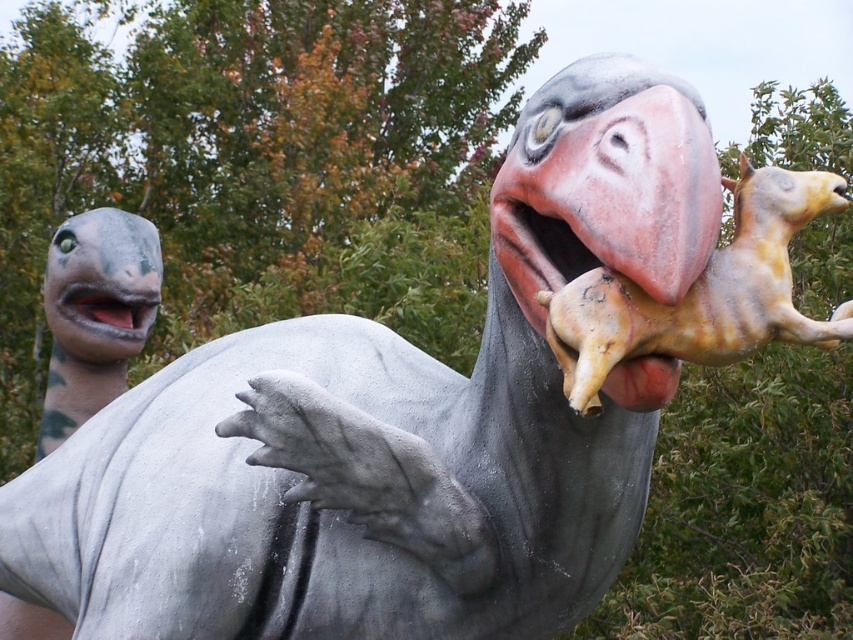
Who is higher up, speckled yellowish-brown horse at upper right or matte gray mouth at left?

matte gray mouth at left

What do you see at coordinates (701, 292) in the screenshot? The width and height of the screenshot is (853, 640). I see `speckled yellowish-brown horse at upper right` at bounding box center [701, 292].

The width and height of the screenshot is (853, 640). What are the coordinates of `speckled yellowish-brown horse at upper right` in the screenshot? It's located at (701, 292).